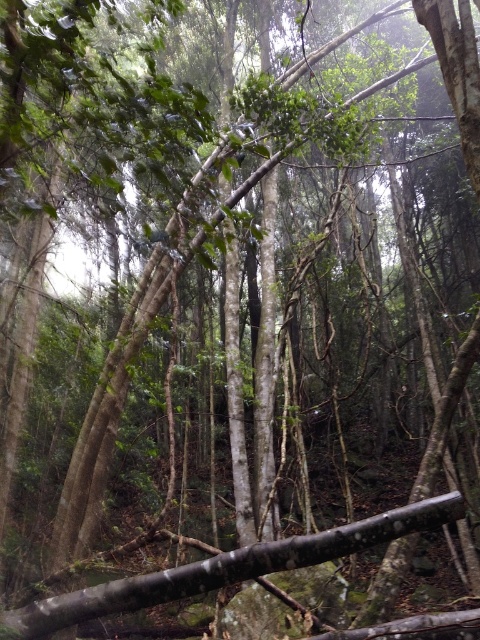
Who is positioned more to the left, smooth brown branch at center or smooth brown rock at center?

Positioned to the left is smooth brown branch at center.

Does point (278, 557) come behind point (242, 608)?

That is False.

What do you see at coordinates (226, 568) in the screenshot? I see `smooth brown branch at center` at bounding box center [226, 568].

You are a GUI agent. You are given a task and a screenshot of the screen. Output one action in this format:
    pyautogui.click(x=<x>, y=<y>)
    Task: Click on the smooth brown branch at center
    The height and width of the screenshot is (640, 480).
    Given the screenshot: What is the action you would take?
    pyautogui.click(x=226, y=568)